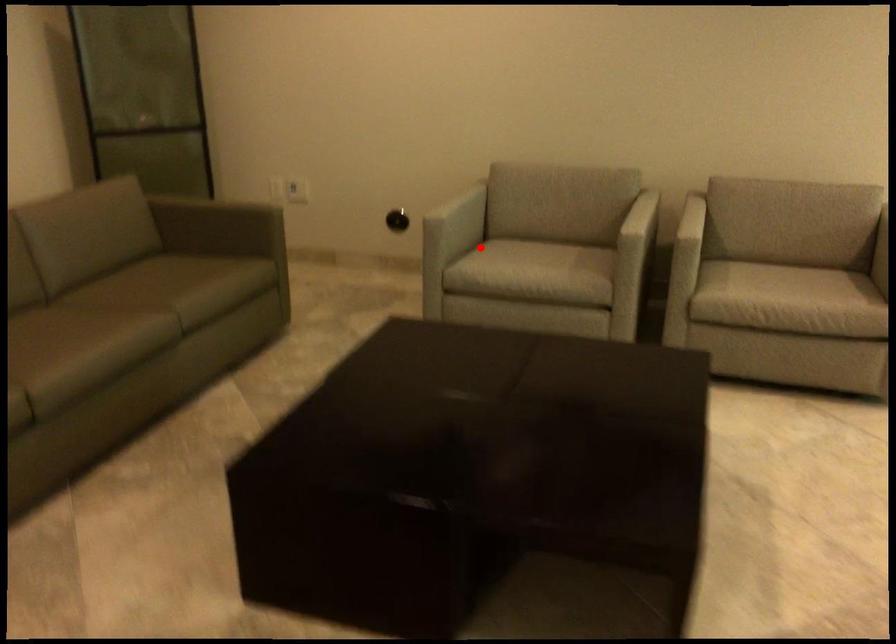
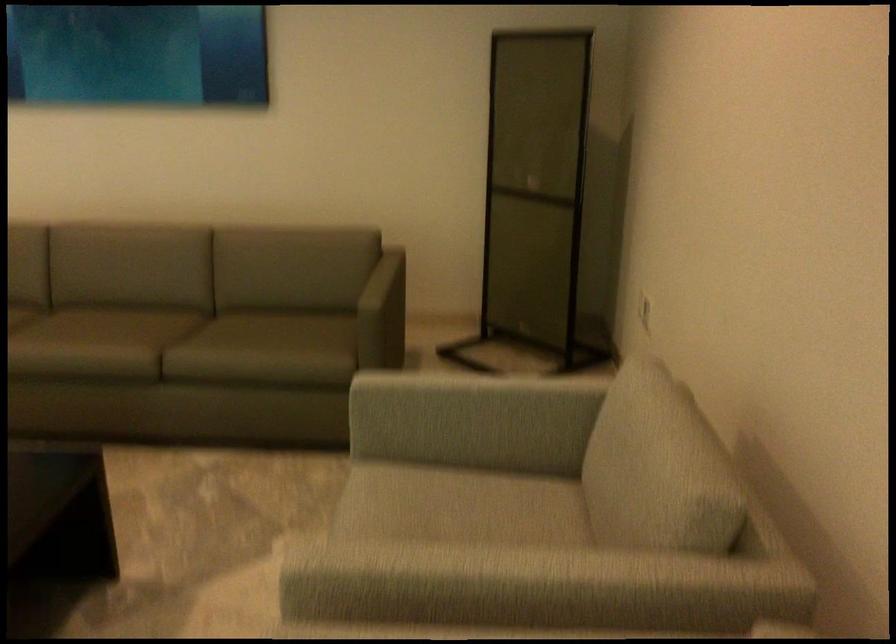
Where in the second image is the point corresponding to the highlighted location from the first image?

(455, 491)